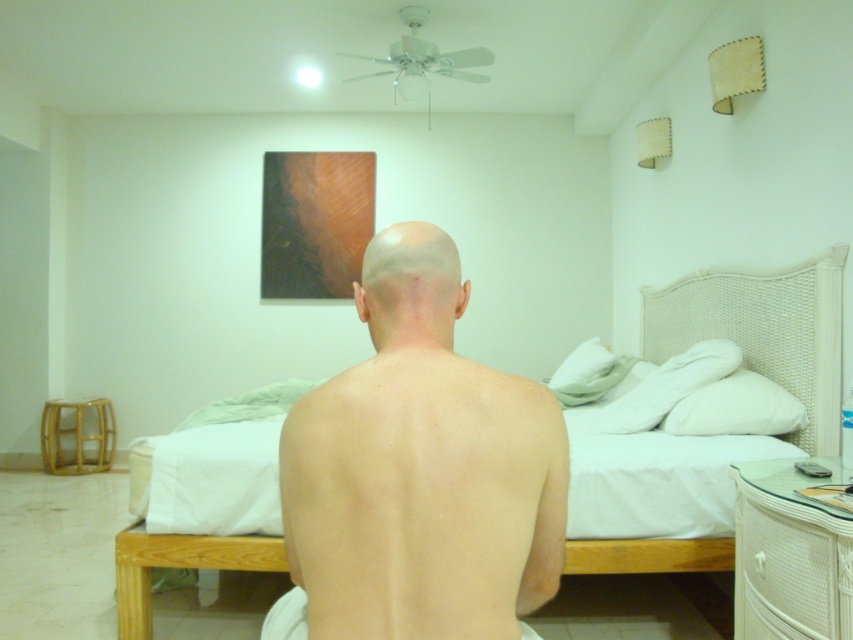
Question: Considering the real-world distances, which object is closest to the smooth skin at center?

Choices:
 (A) white wicker dresser at lower right
 (B) skinny bald man at center

Answer: (B)

Question: Among these points, which one is farthest from the camera?

Choices:
 (A) (850, 611)
 (B) (397, 340)
 (C) (786, 323)
 (D) (323, 502)

Answer: (C)

Question: Where is white woven bed at center located in relation to white wicker dresser at lower right in the image?

Choices:
 (A) left
 (B) right

Answer: (B)

Question: Considering the relative positions of white woven bed at center and white wicker dresser at lower right in the image provided, where is white woven bed at center located with respect to white wicker dresser at lower right?

Choices:
 (A) below
 (B) above

Answer: (B)

Question: Is white woven bed at center positioned before smooth skin at center?

Choices:
 (A) no
 (B) yes

Answer: (A)

Question: Based on their relative distances, which object is farther from the white woven bed at center?

Choices:
 (A) white wicker dresser at lower right
 (B) skinny bald man at center
 (C) smooth skin at center

Answer: (C)